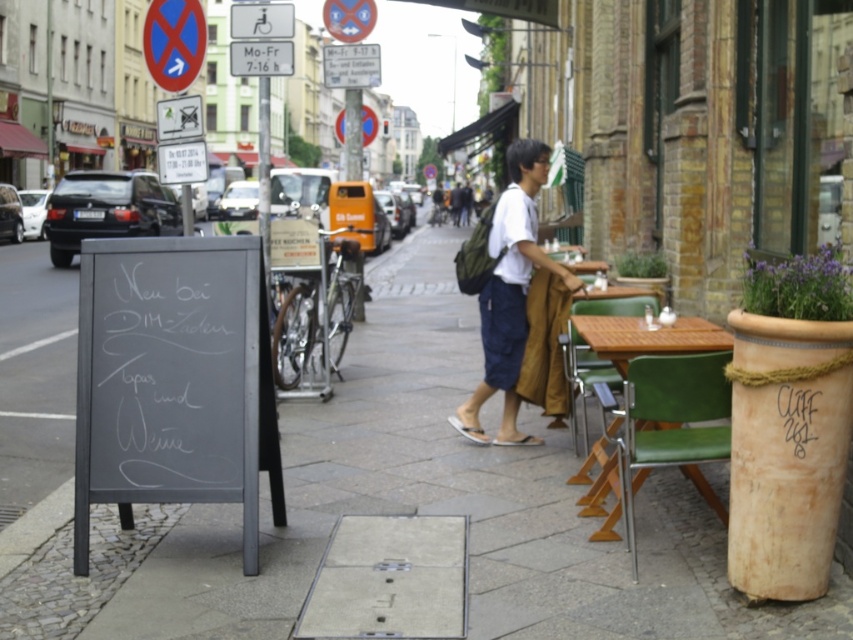
You are a delivery person who needs to place a package on the smooth concrete pavement at center. However, there is a white plastic sign at upper center in the way. Can you move the sign to access the pavement?

The smooth concrete pavement at center is located below the white plastic sign at upper center, so you can move the white plastic sign at upper center out of the way to access the smooth concrete pavement at center.

You are standing on the sidewalk in the scene and want to walk towards the chalkboard sign. Which of the two points, point (740, 628) or point (679, 333), should you head towards to reach the chalkboard sign?

Point (740, 628) is closer to the viewer than point (679, 333), so you should head towards point (740, 628) to reach the chalkboard sign.